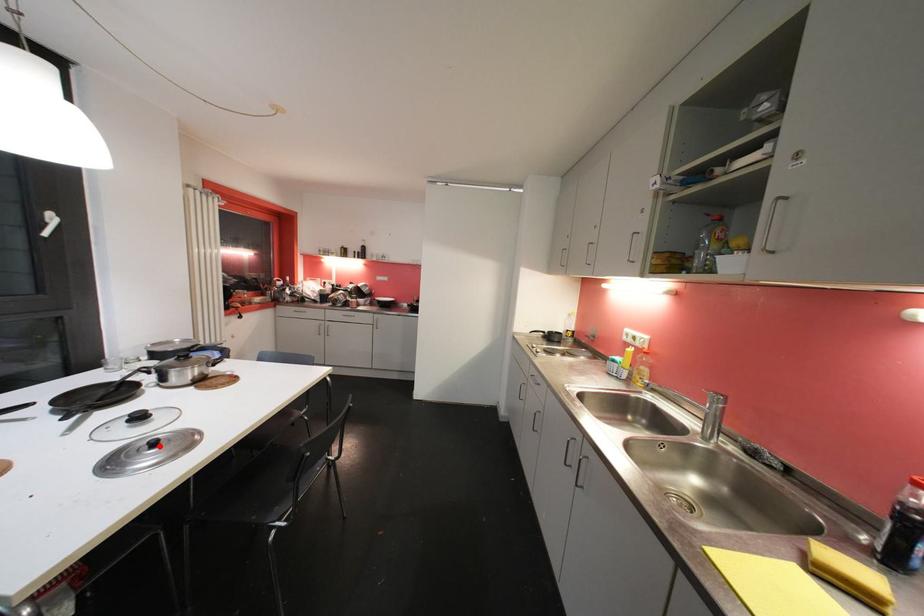
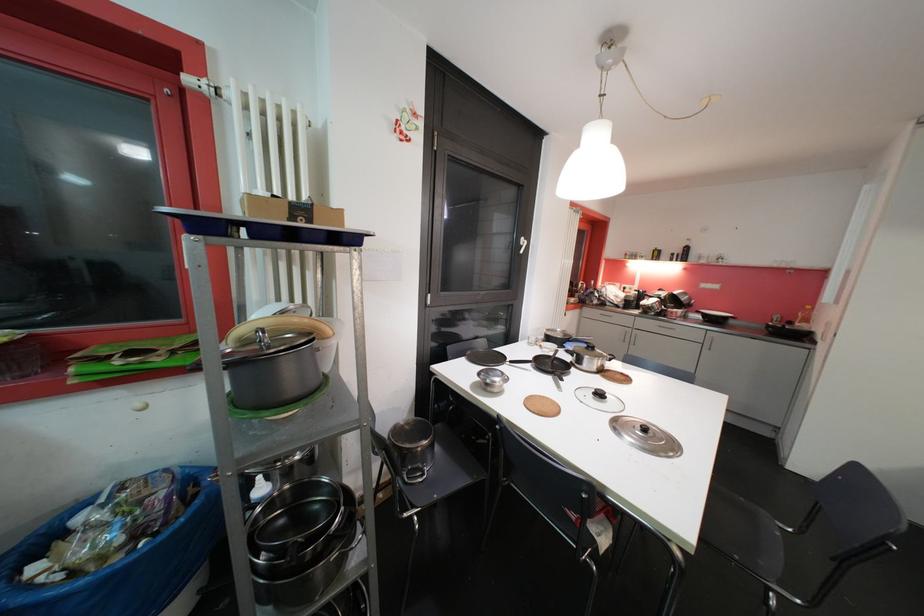
Find the pixel in the second image that matches the highlighted location in the first image.

(650, 432)